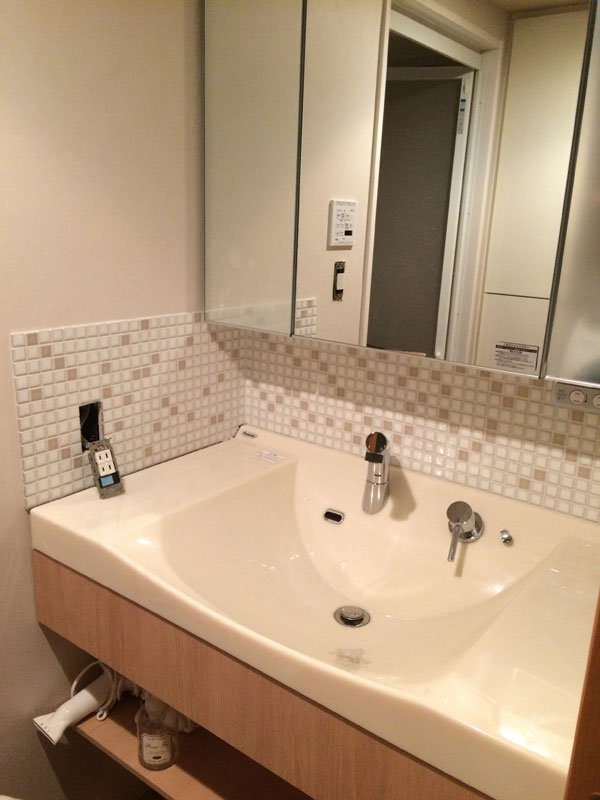
Identify the location of faucet. The height and width of the screenshot is (800, 600). click(x=375, y=448).